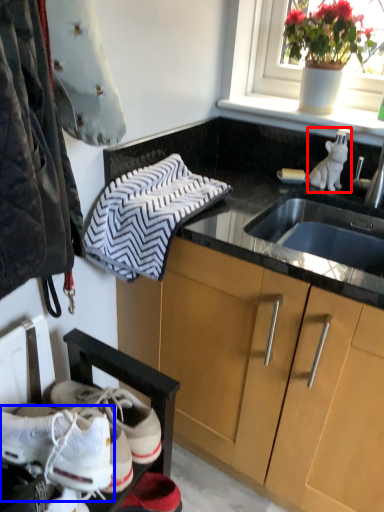
Question: Which of the following is the closest to the observer, animal (highlighted by a red box) or footwear (highlighted by a blue box)?

Choices:
 (A) animal
 (B) footwear

Answer: (B)